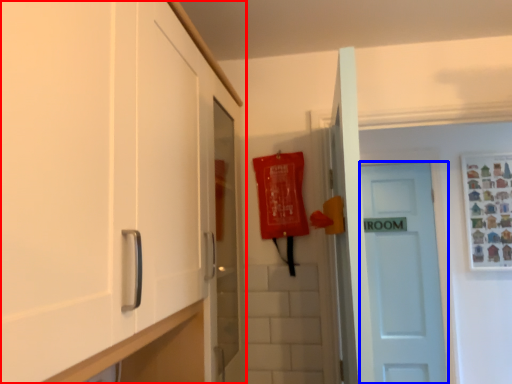
Question: Which of the following is the closest to the observer, cabinetry (highlighted by a red box) or door (highlighted by a blue box)?

Choices:
 (A) cabinetry
 (B) door

Answer: (A)